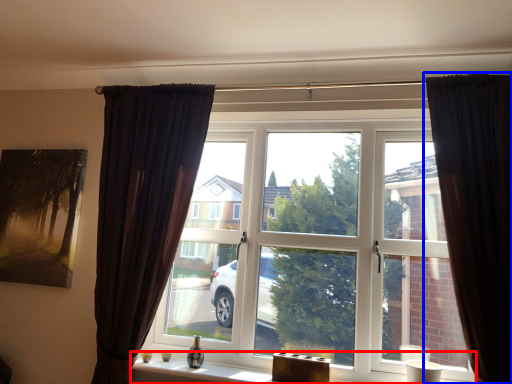
Question: Which of the following is the farthest to the observer, window sill (highlighted by a red box) or curtain (highlighted by a blue box)?

Choices:
 (A) window sill
 (B) curtain

Answer: (A)